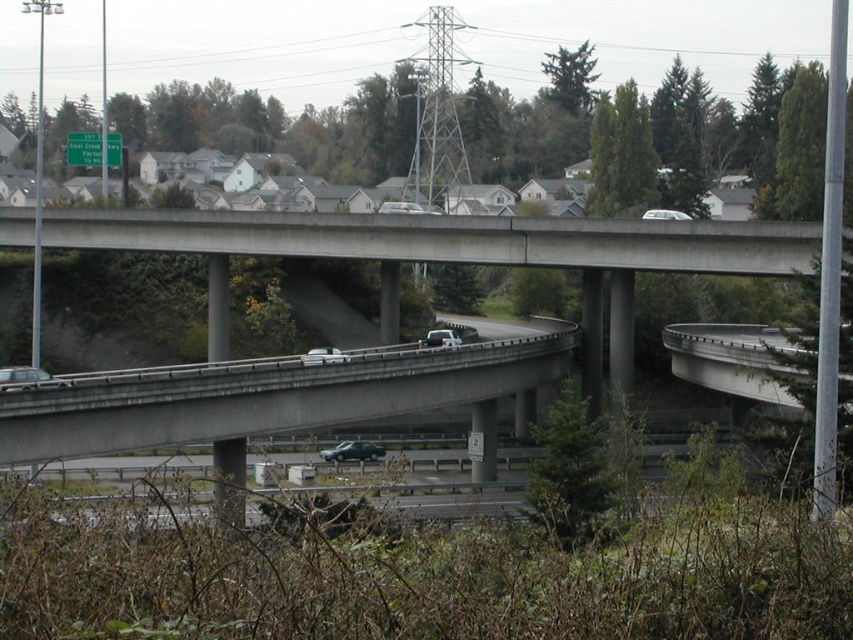
Locate an element on the screen. This screenshot has width=853, height=640. silver metallic sedan at lower left is located at coordinates (26, 378).

Can you confirm if silver metallic sedan at lower left is shorter than white matte sedan at center?

Indeed, silver metallic sedan at lower left has a lesser height compared to white matte sedan at center.

Where is `silver metallic sedan at lower left`? This screenshot has height=640, width=853. silver metallic sedan at lower left is located at coordinates (26, 378).

Find the location of a particular element. silver metallic sedan at lower left is located at coordinates (26, 378).

Between point (346, 442) and point (651, 218), which one is positioned behind?

The point (346, 442) is more distant.

The image size is (853, 640). What do you see at coordinates (352, 451) in the screenshot?
I see `metallic green sedan at center` at bounding box center [352, 451].

You are a GUI agent. You are given a task and a screenshot of the screen. Output one action in this format:
    pyautogui.click(x=<x>, y=<y>)
    Task: Click on the metallic green sedan at center
    The height and width of the screenshot is (640, 853).
    Given the screenshot: What is the action you would take?
    pyautogui.click(x=352, y=451)

Who is positioned more to the left, metallic green sedan at center or white matte truck at center?

Positioned to the left is white matte truck at center.

Does metallic green sedan at center have a lesser height compared to white matte truck at center?

In fact, metallic green sedan at center may be taller than white matte truck at center.

Is point (370, 451) behind point (314, 348)?

No, it is in front of (314, 348).

I want to click on metallic green sedan at center, so click(352, 451).